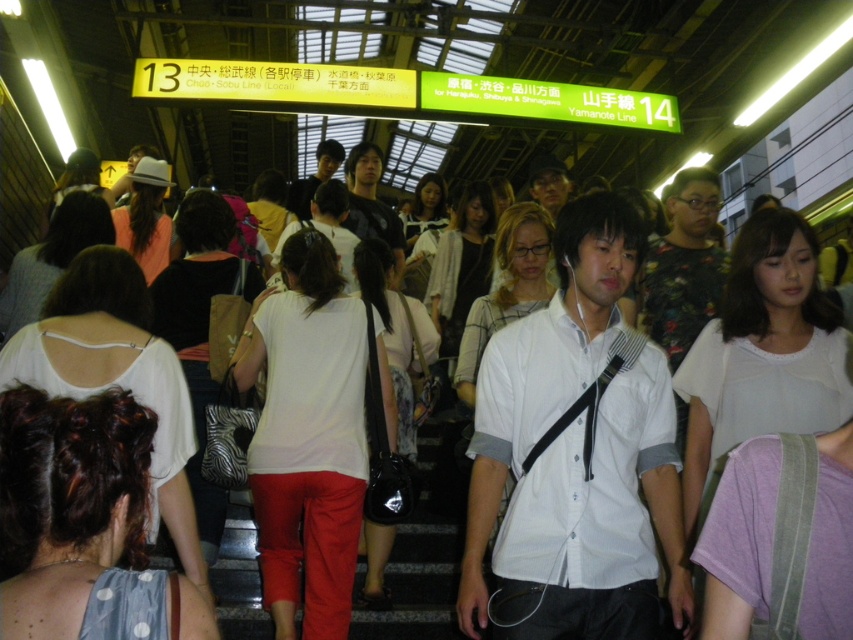
Question: Does white matte shirt at center appear on the right side of white cotton shirt at center?

Choices:
 (A) yes
 (B) no

Answer: (A)

Question: Among these points, which one is farthest from the camera?

Choices:
 (A) (763, 380)
 (B) (204, 556)
 (C) (82, 595)

Answer: (A)

Question: Does white fabric at center have a larger size compared to matte pink shirt at center?

Choices:
 (A) no
 (B) yes

Answer: (A)

Question: Which object appears closest to the camera in this image?

Choices:
 (A) matte pink shirt at center
 (B) white matte shirt at center

Answer: (B)

Question: Is white matte shirt at center to the right of white cotton shirt at center from the viewer's perspective?

Choices:
 (A) no
 (B) yes

Answer: (B)

Question: Which of the following is the farthest from the observer?

Choices:
 (A) (231, 372)
 (B) (238, 292)

Answer: (B)